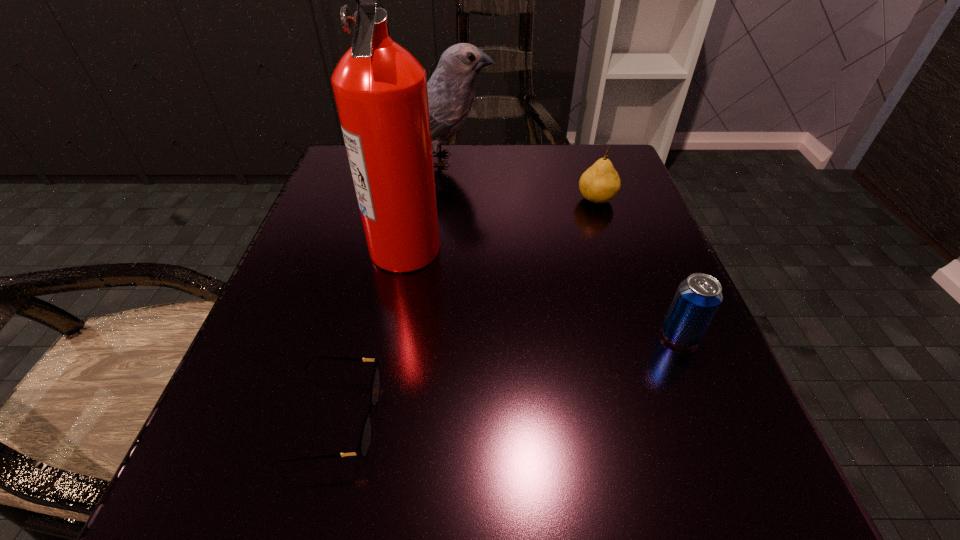
What are the coordinates of `beer can present at the right edge` in the screenshot? It's located at (698, 297).

In order to click on object that is at the far left corner in this screenshot , I will do `click(451, 90)`.

This screenshot has height=540, width=960. I want to click on object located in the near left corner section of the desktop, so click(x=362, y=448).

The height and width of the screenshot is (540, 960). I want to click on object situated at the far right corner, so click(x=600, y=183).

You are a GUI agent. You are given a task and a screenshot of the screen. Output one action in this format:
    pyautogui.click(x=<x>, y=<y>)
    Task: Click on the free space at the far edge of the desktop
    The height and width of the screenshot is (540, 960).
    Given the screenshot: What is the action you would take?
    pyautogui.click(x=461, y=165)

Image resolution: width=960 pixels, height=540 pixels. Identify the location of free space at the near edge. (565, 519).

The width and height of the screenshot is (960, 540). In the image, there is a desktop. In order to click on vacant region at the left edge in this screenshot , I will do `click(339, 414)`.

The height and width of the screenshot is (540, 960). I want to click on vacant space at the right edge of the desktop, so click(x=639, y=386).

In the image, there is a desktop. Where is `vacant area at the far right corner`? The width and height of the screenshot is (960, 540). vacant area at the far right corner is located at coordinates (572, 190).

Where is `vacant space at the near right corner of the desktop`? This screenshot has height=540, width=960. vacant space at the near right corner of the desktop is located at coordinates (776, 536).